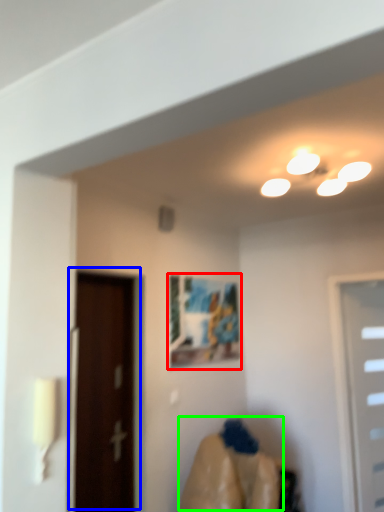
Question: Which object is positioned farthest from picture frame (highlighted by a red box)? Select from door (highlighted by a blue box) and woman (highlighted by a green box).

Choices:
 (A) door
 (B) woman

Answer: (B)